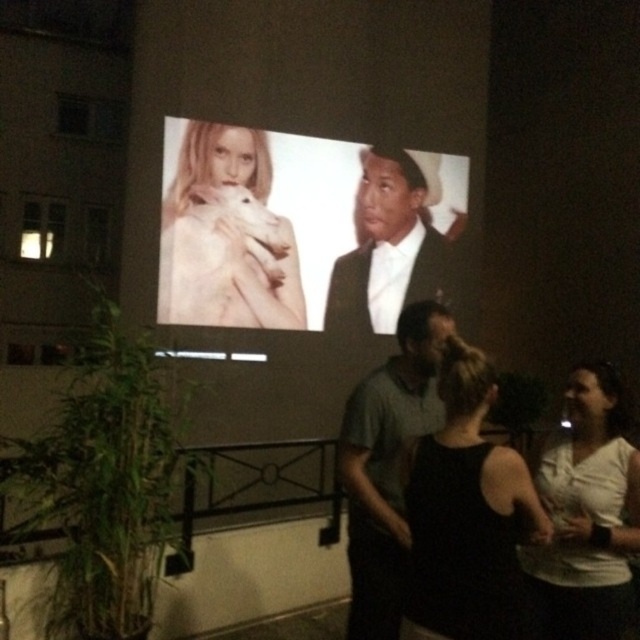
You are an event planner organizing a photoshoot for a fashion show. You need to position a model wearing the black fabric dress at center in front of the white glossy poster at center. Considering their sizes, will the poster be able to cover the dress from head to toe when viewed from the front?

The white glossy poster at center has a greater height compared to black fabric dress at center, so the poster will be tall enough to cover the dress from head to toe when viewed from the front.

You are a photographer at the event and want to capture a clear photo of the white matte shirt at center without the black fabric dress at center blocking it. What should you do?

The black fabric dress at center is positioned over the white matte shirt at center, so to capture a clear photo of the white matte shirt at center without obstruction, you should adjust your angle or move to a position where the black fabric dress at center is no longer in front of it.

From the picture: You are organizing a night event and need to place a 3m wide banner between the white glossy poster at center and the black fabric dress at center. Which object should the banner be placed closer to?

The banner should be placed closer to the white glossy poster at center because it is larger in size than the black fabric dress at center, so the banner would align better with the larger object.